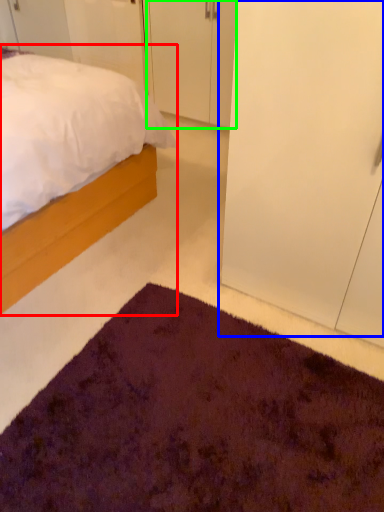
Question: Based on their relative distances, which object is farther from bed (highlighted by a red box)? Choose from glass door (highlighted by a blue box) and door (highlighted by a green box).

Choices:
 (A) glass door
 (B) door

Answer: (B)